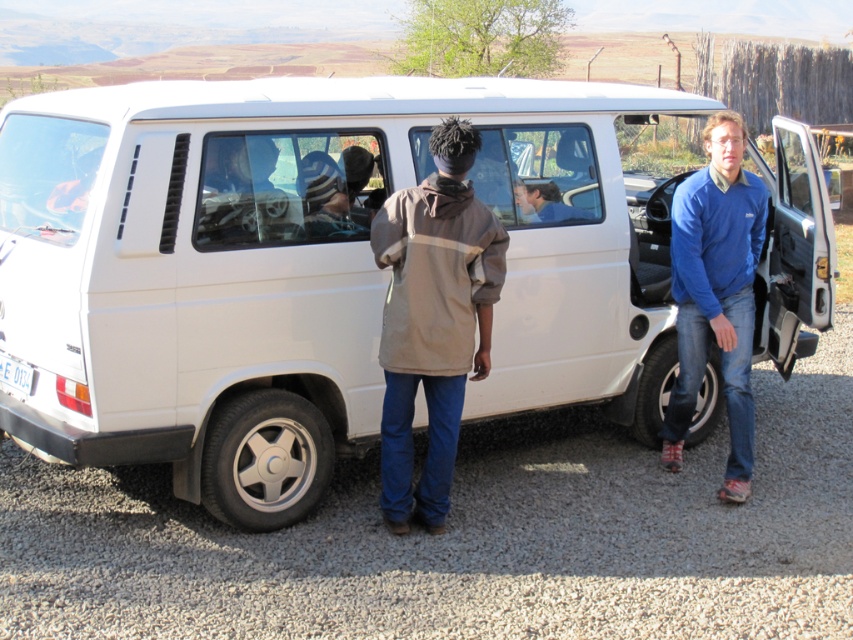
You are a delivery person who needs to load a large box into the white matte van at center. The box is as big as the blue fleece jacket at right. Will the box fit inside the van?

The white matte van at center is bigger than the blue fleece jacket at right, so the box, which is the same size as the blue fleece jacket at right, will fit inside the van.

Consider the image. You are a delivery person who needs to place a package at the point closer to you between point [412,240] and point [694,400]. Which point should you choose?

You should choose point [412,240] because it is closer to the viewer than point [694,400].